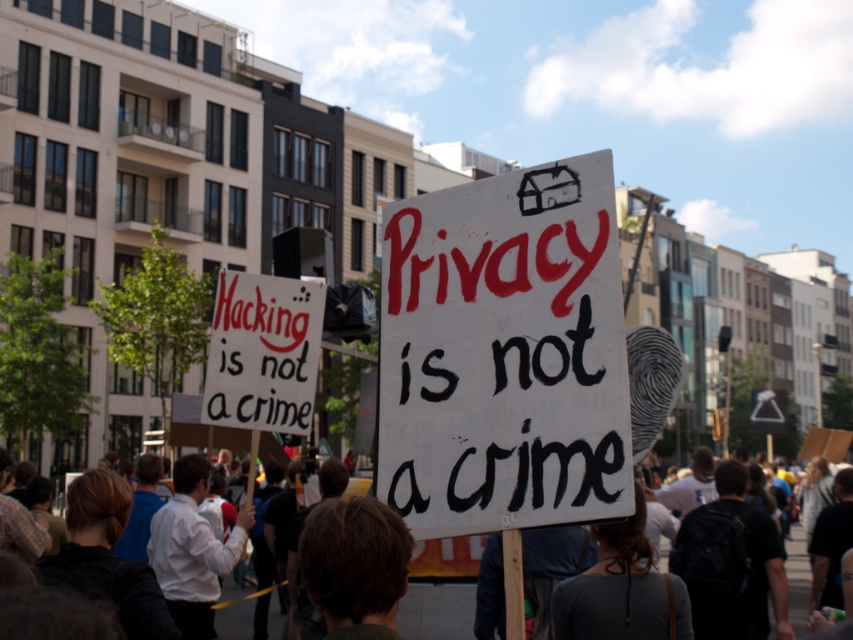
Is white painted cardboard sign at center above white paper sign at center?

Yes.

Which is more to the right, white painted cardboard sign at center or white paper sign at center?

From the viewer's perspective, white painted cardboard sign at center appears more on the right side.

The width and height of the screenshot is (853, 640). Find the location of `white painted cardboard sign at center`. white painted cardboard sign at center is located at coordinates (503, 355).

The image size is (853, 640). I want to click on white painted cardboard sign at center, so click(503, 355).

Between white painted cardboard sign at center and dark brown hair at center, which one is positioned lower?

dark brown hair at center is below.

Find the location of `white painted cardboard sign at center`. white painted cardboard sign at center is located at coordinates (503, 355).

At what (x,y) coordinates should I click in order to perform the action: click on white painted cardboard sign at center. Please return your answer as a coordinate pair (x, y). Image resolution: width=853 pixels, height=640 pixels. Looking at the image, I should click on (503, 355).

Can you confirm if white paper sign at center is thinner than dark brown hair at center?

Yes.

Does point (254, 292) come closer to viewer compared to point (451, 624)?

Yes, point (254, 292) is in front of point (451, 624).

Measure the distance between point [242,296] and camera.

Point [242,296] is 49.30 feet from camera.

Identify the location of white paper sign at center. (263, 353).